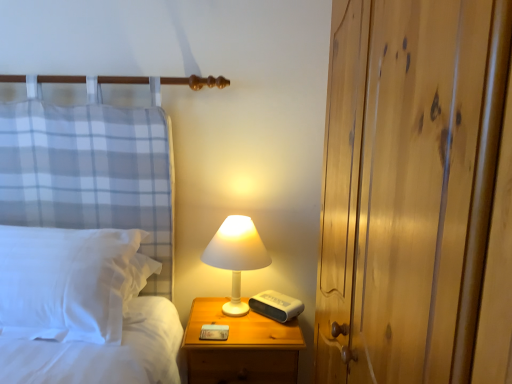
I want to click on vacant space in front of white matte lamp at center, so click(x=238, y=332).